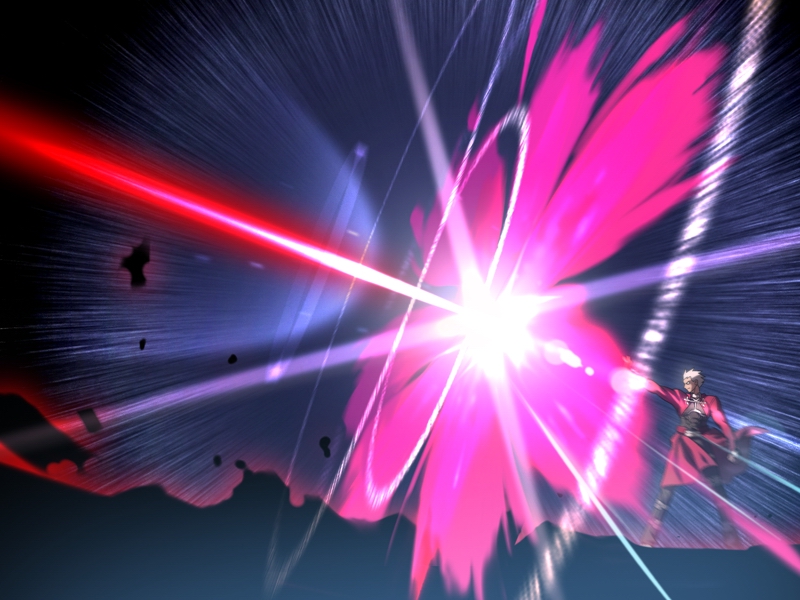
Where is `dust`? This screenshot has height=600, width=800. dust is located at coordinates (322, 205).